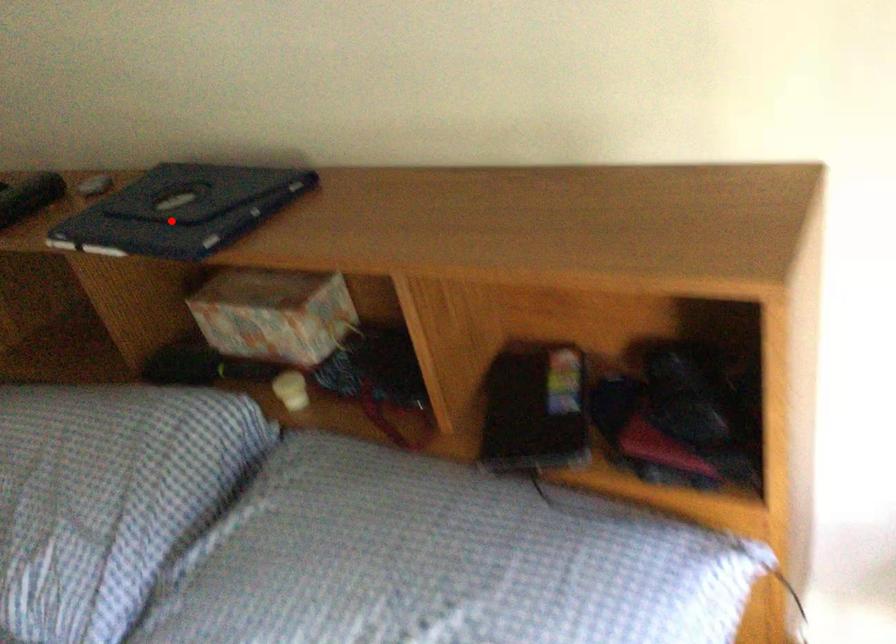
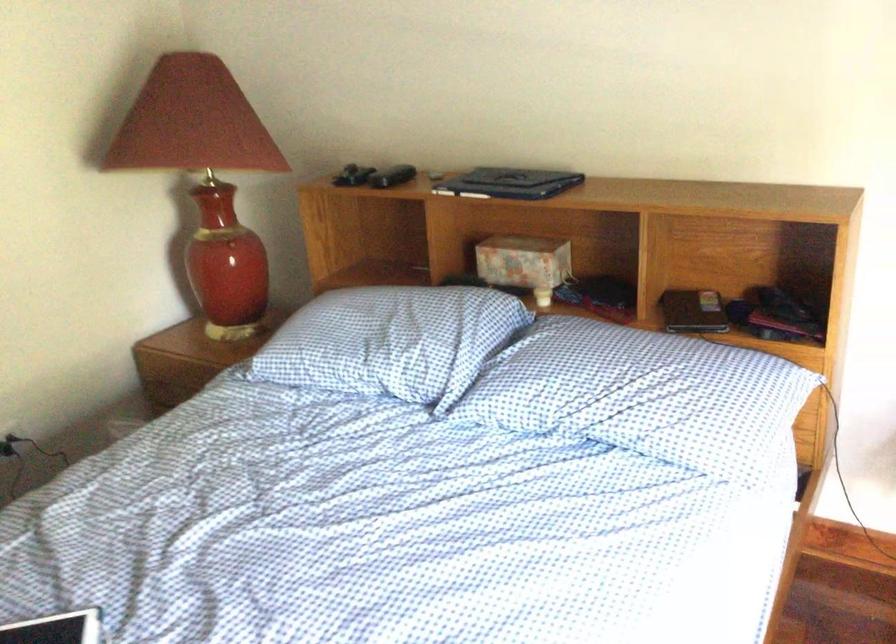
Where in the second image is the point corresponding to the highlighted location from the first image?

(510, 183)